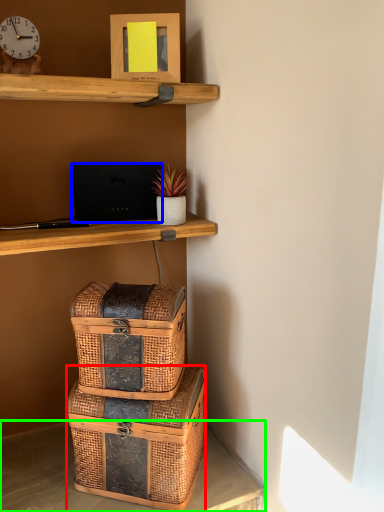
Question: Based on their relative distances, which object is farther from box (highlighted by a red box)? Choose from laptop (highlighted by a blue box) and desk (highlighted by a green box).

Choices:
 (A) laptop
 (B) desk

Answer: (A)